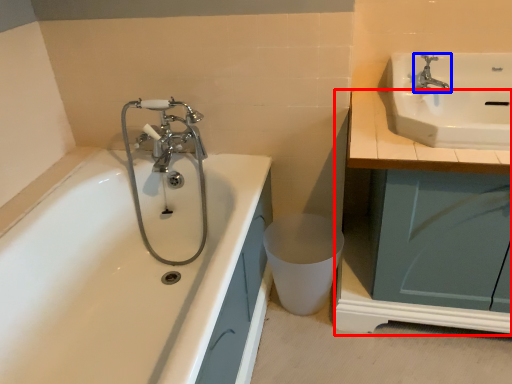
Question: Which point is further to the camera, counter top (highlighted by a red box) or tap (highlighted by a blue box)?

Choices:
 (A) counter top
 (B) tap

Answer: (B)